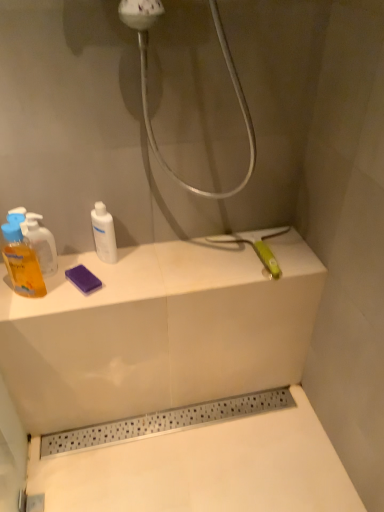
Identify the location of translucent orange liquid at left, acting as the second mouthwash starting from the left. (41, 242).

Find the location of a particular element. The image size is (384, 512). translucent yellow liquid at left, the 3th mouthwash viewed from the right is located at coordinates (21, 260).

What's the angular difference between translucent orange liquid at left, acting as the 2th mouthwash starting from the right, and white glossy bottle at center, which is counted as the 3th mouthwash, starting from the left,'s facing directions?

The angle between the facing direction of translucent orange liquid at left, acting as the 2th mouthwash starting from the right, and the facing direction of white glossy bottle at center, which is counted as the 3th mouthwash, starting from the left, is 31.2 degrees.

Is point (40, 234) positioned in front of point (98, 217)?

That is True.

What are the coordinates of `mouthwash located behind the translucent orange liquid at left, acting as the second mouthwash starting from the left` in the screenshot? It's located at (104, 233).

Is translucent orange liquid at left, acting as the 2th mouthwash starting from the right, thinner than white glossy bottle at center, the first mouthwash viewed from the right?

Incorrect, the width of translucent orange liquid at left, acting as the 2th mouthwash starting from the right, is not less than that of white glossy bottle at center, the first mouthwash viewed from the right.

Is point (115, 238) farther from camera compared to point (46, 248)?

That is True.

Could you tell me if white glossy bottle at center, which is counted as the 3th mouthwash, starting from the left, is facing translucent orange liquid at left, acting as the 2th mouthwash starting from the right?

No, white glossy bottle at center, which is counted as the 3th mouthwash, starting from the left, is not oriented towards translucent orange liquid at left, acting as the 2th mouthwash starting from the right.

Can you tell me how much white glossy bottle at center, which is counted as the 3th mouthwash, starting from the left, and translucent orange liquid at left, acting as the 2th mouthwash starting from the right, differ in facing direction?

The angular difference between white glossy bottle at center, which is counted as the 3th mouthwash, starting from the left, and translucent orange liquid at left, acting as the 2th mouthwash starting from the right, is 31.2 degrees.

Based on their sizes in the image, would you say white glossy bottle at center, which is counted as the 3th mouthwash, starting from the left, is bigger or smaller than translucent orange liquid at left, acting as the second mouthwash starting from the left?

Considering their sizes, white glossy bottle at center, which is counted as the 3th mouthwash, starting from the left, takes up less space than translucent orange liquid at left, acting as the second mouthwash starting from the left.

From the image's perspective, starting from the translucent yellow liquid at left, the 3th mouthwash viewed from the right, which mouthwash is the 1st one above? Please provide its 2D coordinates.

[(41, 242)]

Does translucent yellow liquid at left, the first mouthwash when ordered from left to right, touch translucent orange liquid at left, acting as the 2th mouthwash starting from the right?

Yes, translucent yellow liquid at left, the first mouthwash when ordered from left to right, is beside translucent orange liquid at left, acting as the 2th mouthwash starting from the right.

From a real-world perspective, is translucent yellow liquid at left, the first mouthwash when ordered from left to right, physically located above or below translucent orange liquid at left, acting as the 2th mouthwash starting from the right?

translucent yellow liquid at left, the first mouthwash when ordered from left to right, is above translucent orange liquid at left, acting as the 2th mouthwash starting from the right.

In the image, is translucent yellow liquid at left, the first mouthwash when ordered from left to right, on the left side or the right side of translucent orange liquid at left, acting as the 2th mouthwash starting from the right?

translucent yellow liquid at left, the first mouthwash when ordered from left to right, is positioned on translucent orange liquid at left, acting as the 2th mouthwash starting from the right,'s left side.

Is translucent orange liquid at left, acting as the second mouthwash starting from the left, aimed at translucent yellow liquid at left, the 3th mouthwash viewed from the right?

Yes, translucent orange liquid at left, acting as the second mouthwash starting from the left, is aimed at translucent yellow liquid at left, the 3th mouthwash viewed from the right.

Can translucent yellow liquid at left, the first mouthwash when ordered from left to right, be found inside translucent orange liquid at left, acting as the second mouthwash starting from the left?

No.

Looking at this image, how distant is translucent orange liquid at left, acting as the second mouthwash starting from the left, from translucent yellow liquid at left, the 3th mouthwash viewed from the right?

They are 1.90 inches apart.

Image resolution: width=384 pixels, height=512 pixels. I want to click on mouthwash lying on the left of translucent orange liquid at left, acting as the second mouthwash starting from the left, so click(x=21, y=260).

Could you measure the distance between translucent yellow liquid at left, the 3th mouthwash viewed from the right, and white glossy bottle at center, which is counted as the 3th mouthwash, starting from the left?

translucent yellow liquid at left, the 3th mouthwash viewed from the right, is 7.80 inches away from white glossy bottle at center, which is counted as the 3th mouthwash, starting from the left.

Find the location of `mouthwash that is the 2nd one above the white glossy bottle at center, which is counted as the 3th mouthwash, starting from the left (from a real-world perspective)`. mouthwash that is the 2nd one above the white glossy bottle at center, which is counted as the 3th mouthwash, starting from the left (from a real-world perspective) is located at coordinates (21, 260).

Could you tell me if translucent yellow liquid at left, the first mouthwash when ordered from left to right, is turned towards white glossy bottle at center, which is counted as the 3th mouthwash, starting from the left?

No, translucent yellow liquid at left, the first mouthwash when ordered from left to right, is not oriented towards white glossy bottle at center, which is counted as the 3th mouthwash, starting from the left.

Does translucent yellow liquid at left, the 3th mouthwash viewed from the right, have a larger size compared to white glossy bottle at center, the first mouthwash viewed from the right?

Yes.

Is white glossy bottle at center, the first mouthwash viewed from the right, wider than translucent yellow liquid at left, the first mouthwash when ordered from left to right?

Incorrect, the width of white glossy bottle at center, the first mouthwash viewed from the right, does not surpass that of translucent yellow liquid at left, the first mouthwash when ordered from left to right.

Consider the image. Based on their positions, is white glossy bottle at center, which is counted as the 3th mouthwash, starting from the left, located to the left or right of translucent yellow liquid at left, the first mouthwash when ordered from left to right?

From the image, it's evident that white glossy bottle at center, which is counted as the 3th mouthwash, starting from the left, is to the right of translucent yellow liquid at left, the first mouthwash when ordered from left to right.

Is white glossy bottle at center, the first mouthwash viewed from the right, positioned with its back to translucent yellow liquid at left, the first mouthwash when ordered from left to right?

No, white glossy bottle at center, the first mouthwash viewed from the right, is not facing away from translucent yellow liquid at left, the first mouthwash when ordered from left to right.

The image size is (384, 512). In order to click on mouthwash lying above the translucent orange liquid at left, acting as the 2th mouthwash starting from the right (from the image's perspective) in this screenshot , I will do `click(104, 233)`.

What are the coordinates of `the 1st mouthwash located above the white glossy bottle at center, the first mouthwash viewed from the right (from a real-world perspective)` in the screenshot? It's located at (41, 242).

Estimate the real-world distances between objects in this image. Which object is further from translucent orange liquid at left, acting as the second mouthwash starting from the left, white glossy bottle at center, the first mouthwash viewed from the right, or translucent yellow liquid at left, the 3th mouthwash viewed from the right?

white glossy bottle at center, the first mouthwash viewed from the right, is positioned further to the anchor translucent orange liquid at left, acting as the second mouthwash starting from the left.

Based on their spatial positions, is translucent orange liquid at left, acting as the second mouthwash starting from the left, or translucent yellow liquid at left, the first mouthwash when ordered from left to right, closer to white glossy bottle at center, which is counted as the 3th mouthwash, starting from the left?

translucent orange liquid at left, acting as the second mouthwash starting from the left, is closer to white glossy bottle at center, which is counted as the 3th mouthwash, starting from the left.

When comparing their distances from translucent orange liquid at left, acting as the 2th mouthwash starting from the right, does translucent yellow liquid at left, the first mouthwash when ordered from left to right, or white glossy bottle at center, the first mouthwash viewed from the right, seem closer?

Among the two, translucent yellow liquid at left, the first mouthwash when ordered from left to right, is located nearer to translucent orange liquid at left, acting as the 2th mouthwash starting from the right.

Estimate the real-world distances between objects in this image. Which object is further from translucent yellow liquid at left, the 3th mouthwash viewed from the right, white glossy bottle at center, which is counted as the 3th mouthwash, starting from the left, or translucent orange liquid at left, acting as the 2th mouthwash starting from the right?

white glossy bottle at center, which is counted as the 3th mouthwash, starting from the left.

Estimate the real-world distances between objects in this image. Which object is further from white glossy bottle at center, the first mouthwash viewed from the right, translucent yellow liquid at left, the first mouthwash when ordered from left to right, or translucent orange liquid at left, acting as the 2th mouthwash starting from the right?

Based on the image, translucent yellow liquid at left, the first mouthwash when ordered from left to right, appears to be further to white glossy bottle at center, the first mouthwash viewed from the right.

Looking at the image, which one is located further to translucent yellow liquid at left, the 3th mouthwash viewed from the right, translucent orange liquid at left, acting as the second mouthwash starting from the left, or white glossy bottle at center, the first mouthwash viewed from the right?

white glossy bottle at center, the first mouthwash viewed from the right, is further to translucent yellow liquid at left, the 3th mouthwash viewed from the right.

Image resolution: width=384 pixels, height=512 pixels. In order to click on mouthwash between translucent yellow liquid at left, the first mouthwash when ordered from left to right, and white glossy bottle at center, the first mouthwash viewed from the right in this screenshot , I will do `click(41, 242)`.